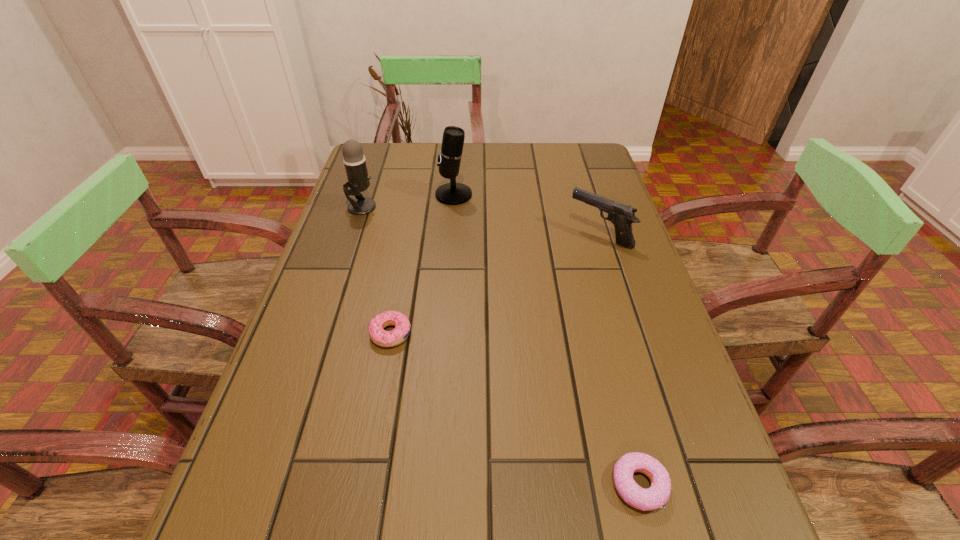
This screenshot has height=540, width=960. Find the location of `vacant area between the left microphone and the third nearest object`. vacant area between the left microphone and the third nearest object is located at coordinates (481, 221).

I want to click on vacant region between the third object from left to right and the gun, so pos(527,215).

What are the coordinates of `object that is the fourth nearest to the fourth object from right to left` in the screenshot? It's located at (622, 216).

This screenshot has height=540, width=960. In order to click on the closest object to the third object from right to left in this screenshot , I will do `click(358, 179)`.

Where is `free spot that satisfies the following two spatial constraints: 1. at the muzzle of the third nearest object; 2. on the front side of the right doughnut`? The image size is (960, 540). free spot that satisfies the following two spatial constraints: 1. at the muzzle of the third nearest object; 2. on the front side of the right doughnut is located at coordinates (677, 485).